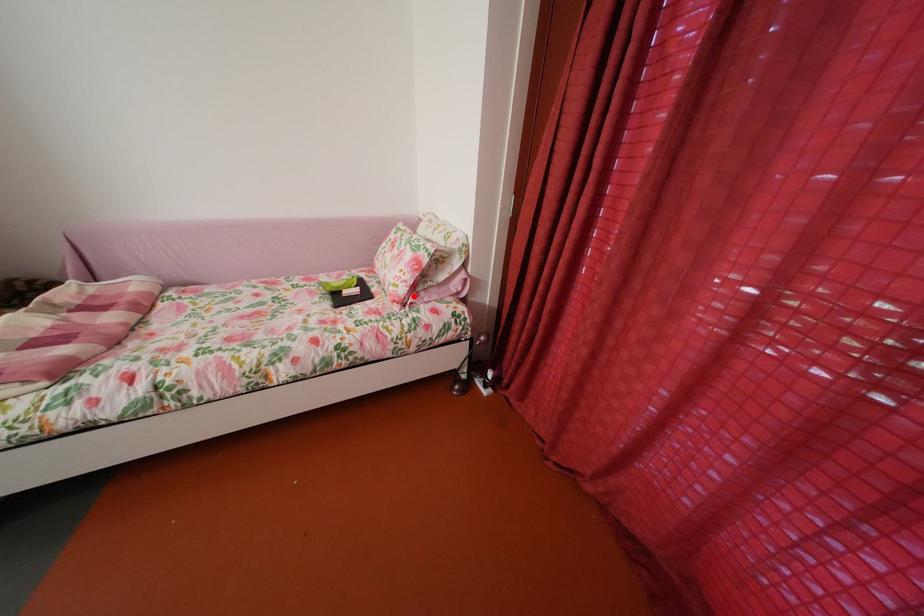
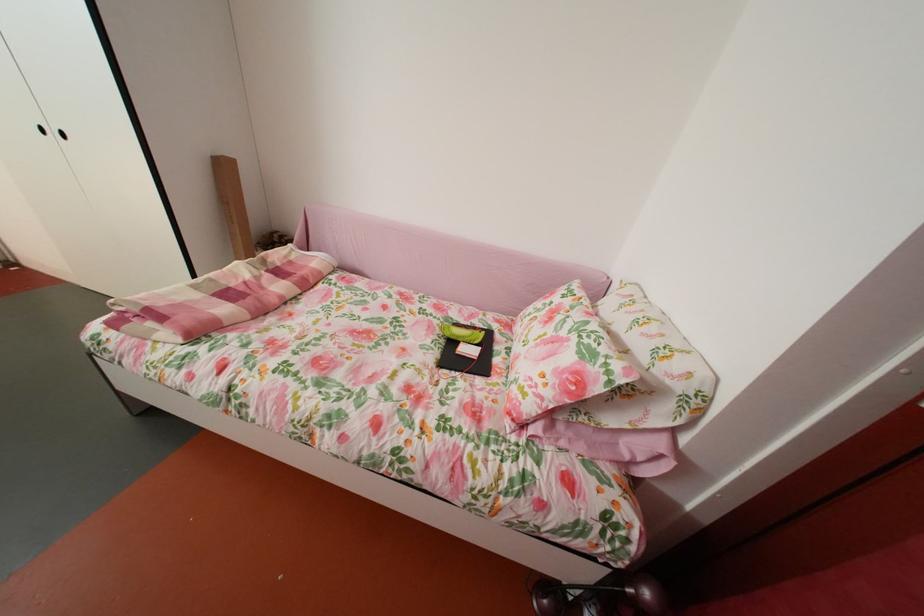
Question: I am providing you with two images of the same scene from different viewpoints. Given a red point in image1, look at the same physical point in image2. Is it:

Choices:
 (A) Closer to the viewpoint
 (B) Farther from the viewpoint

Answer: (B)